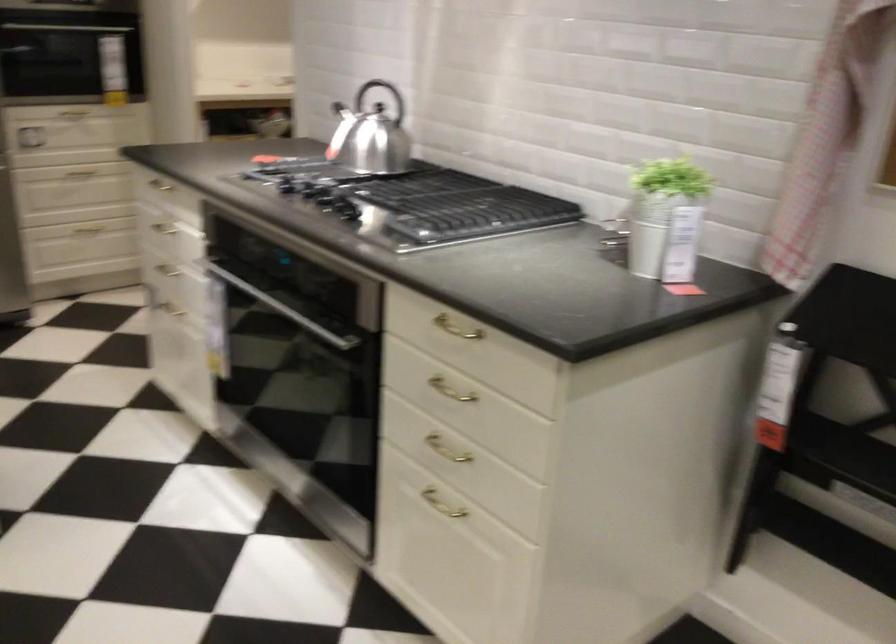
The width and height of the screenshot is (896, 644). I want to click on silver oven handle, so click(282, 308).